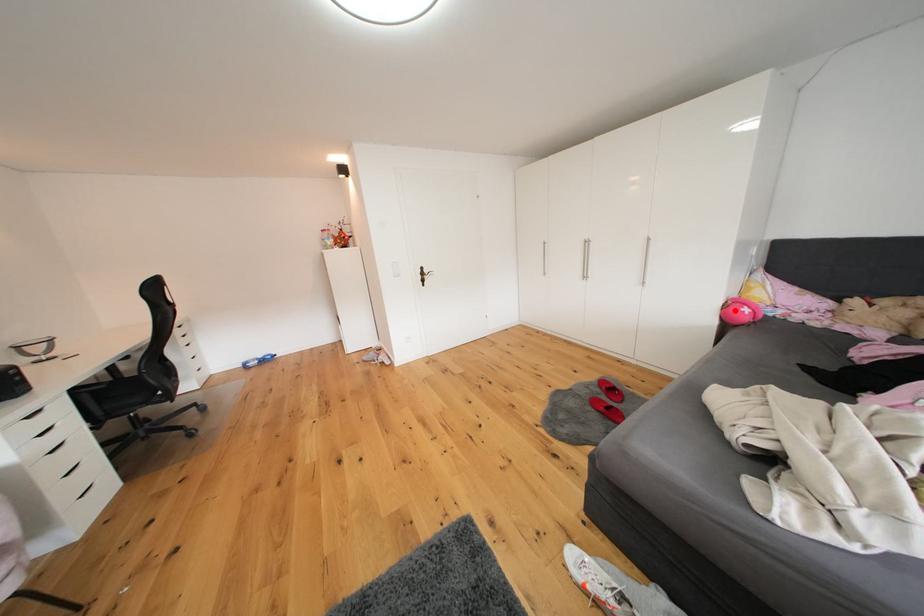
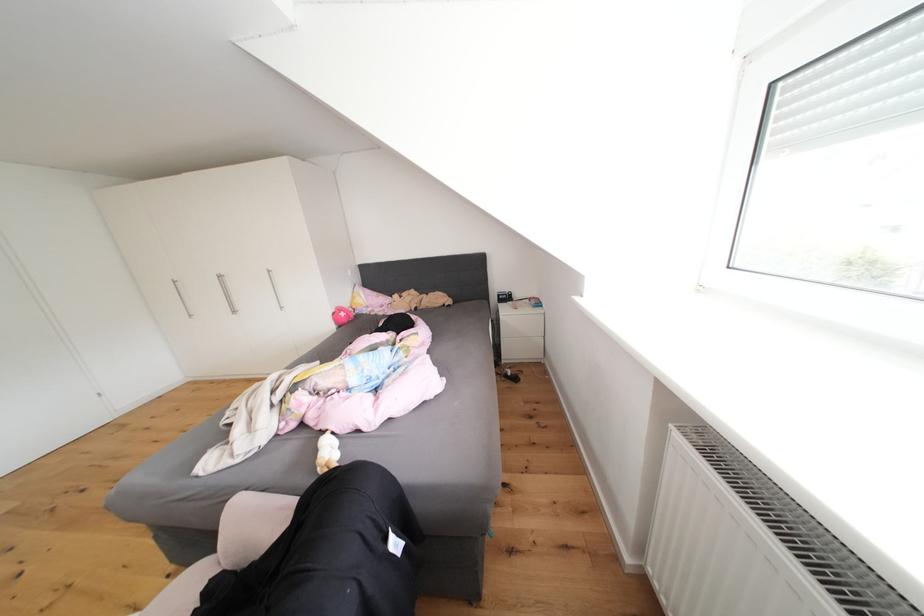
In the second image, find the point that corresponds to the highlighted location in the first image.

(343, 318)